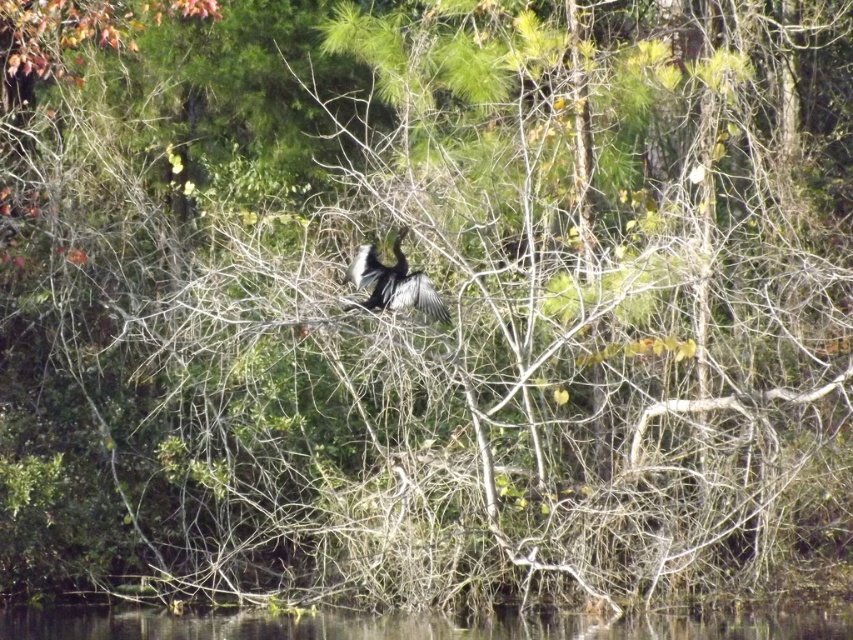
Is point (57, 614) farther from camera compared to point (405, 296)?

Yes, it is behind point (405, 296).

Does clear water at lower center have a smaller size compared to black glossy bird at center?

No.

Who is more distant from viewer, (84, 608) or (408, 291)?

The point (84, 608) is behind.

The height and width of the screenshot is (640, 853). What are the coordinates of `clear water at lower center` in the screenshot? It's located at (415, 625).